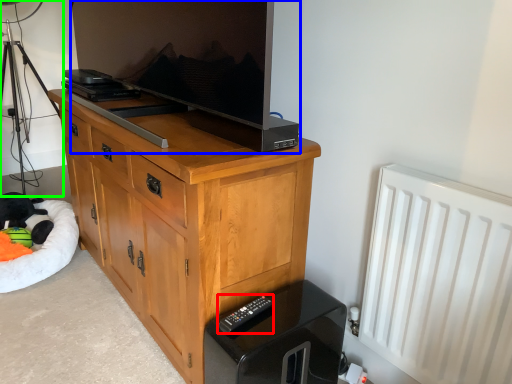
Question: Which object is positioned farthest from remote (highlighted by a red box)? Select from television (highlighted by a blue box) and tripod (highlighted by a green box).

Choices:
 (A) television
 (B) tripod

Answer: (B)